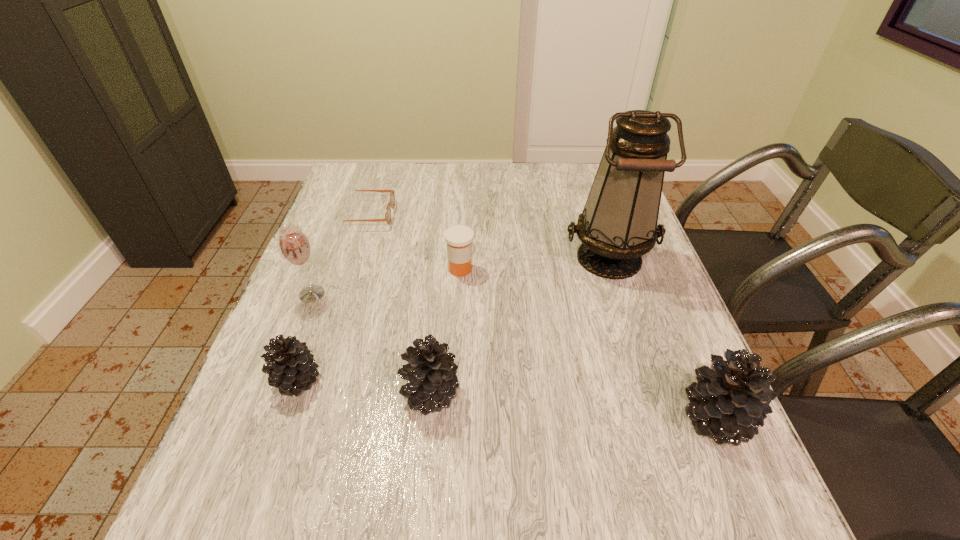
Image resolution: width=960 pixels, height=540 pixels. I want to click on unoccupied position between the wineglass and the shortest object, so click(x=339, y=254).

Select which object is the third closest to the rightmost pinecone. Please provide its 2D coordinates. Your answer should be formatted as a tuple, i.e. [(x, y)], where the tuple contains the x and y coordinates of a point satisfying the conditions above.

[(459, 238)]

Identify which object is located as the third nearest to the medicine. Please provide its 2D coordinates. Your answer should be formatted as a tuple, i.e. [(x, y)], where the tuple contains the x and y coordinates of a point satisfying the conditions above.

[(431, 372)]

Identify which pinecone is the second closest to the shortest object. Please provide its 2D coordinates. Your answer should be formatted as a tuple, i.e. [(x, y)], where the tuple contains the x and y coordinates of a point satisfying the conditions above.

[(431, 372)]

The height and width of the screenshot is (540, 960). In order to click on pinecone that is the second nearest to the medicine in this screenshot , I will do `click(291, 367)`.

Find the location of a particular element. The image size is (960, 540). vacant area in the image that satisfies the following two spatial constraints: 1. on the front side of the fourth shortest object; 2. on the right side of the rightmost pinecone is located at coordinates (428, 418).

Find the location of a particular element. Image resolution: width=960 pixels, height=540 pixels. vacant space that satisfies the following two spatial constraints: 1. on the back side of the oil lamp; 2. on the right side of the second pinecone from right to left is located at coordinates (444, 258).